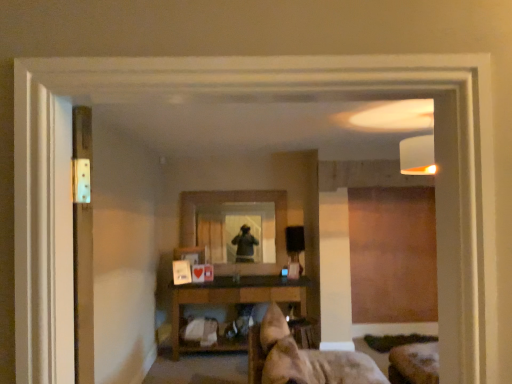
Question: Is metallic silver screen door at left taller than clear glass mirror at center?

Choices:
 (A) yes
 (B) no

Answer: (B)

Question: From the image's perspective, is metallic silver screen door at left on clear glass mirror at center?

Choices:
 (A) no
 (B) yes

Answer: (B)

Question: Considering the relative sizes of metallic silver screen door at left and clear glass mirror at center in the image provided, is metallic silver screen door at left wider than clear glass mirror at center?

Choices:
 (A) no
 (B) yes

Answer: (A)

Question: Is metallic silver screen door at left to the right of clear glass mirror at center from the viewer's perspective?

Choices:
 (A) no
 (B) yes

Answer: (A)

Question: Is metallic silver screen door at left bigger than clear glass mirror at center?

Choices:
 (A) no
 (B) yes

Answer: (A)

Question: Considering the positions of metallic silver screen door at left and clear glass mirror at center in the image, is metallic silver screen door at left wider or thinner than clear glass mirror at center?

Choices:
 (A) wide
 (B) thin

Answer: (B)

Question: From a real-world perspective, is metallic silver screen door at left positioned above or below clear glass mirror at center?

Choices:
 (A) above
 (B) below

Answer: (A)

Question: Would you say metallic silver screen door at left is to the left or to the right of clear glass mirror at center in the picture?

Choices:
 (A) left
 (B) right

Answer: (A)

Question: Considering their positions, is metallic silver screen door at left located in front of or behind clear glass mirror at center?

Choices:
 (A) behind
 (B) front

Answer: (B)

Question: Is brown wooden shelf at center taller or shorter than clear glass mirror at center?

Choices:
 (A) tall
 (B) short

Answer: (B)

Question: Which is correct: brown wooden shelf at center is inside clear glass mirror at center, or outside of it?

Choices:
 (A) outside
 (B) inside

Answer: (A)

Question: In terms of size, does brown wooden shelf at center appear bigger or smaller than clear glass mirror at center?

Choices:
 (A) small
 (B) big

Answer: (B)

Question: From the image's perspective, is brown wooden shelf at center above or below clear glass mirror at center?

Choices:
 (A) above
 (B) below

Answer: (B)

Question: From a real-world perspective, is clear glass mirror at center above or below brown wooden shelf at center?

Choices:
 (A) below
 (B) above

Answer: (B)

Question: Is clear glass mirror at center taller or shorter than brown wooden shelf at center?

Choices:
 (A) short
 (B) tall

Answer: (B)